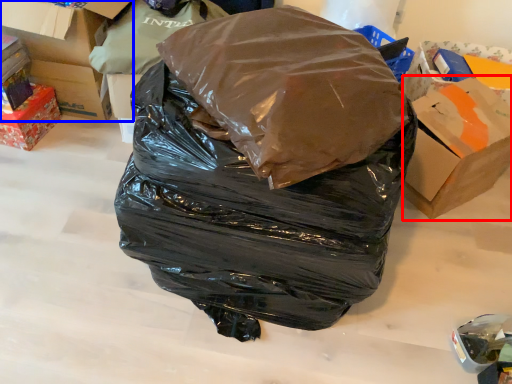
Question: Which object is further to the camera taking this photo, cardboard box (highlighted by a red box) or box (highlighted by a blue box)?

Choices:
 (A) cardboard box
 (B) box

Answer: (B)